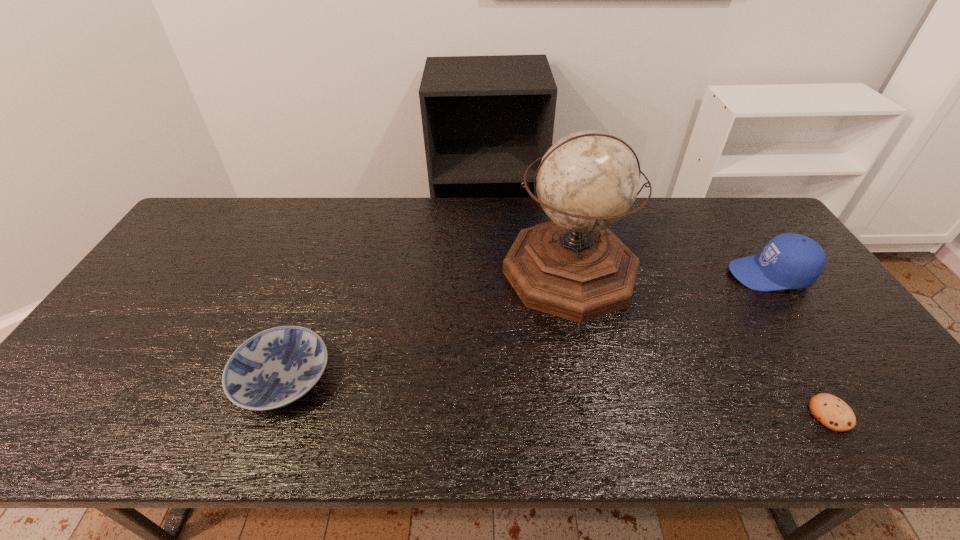
You are a GUI agent. You are given a task and a screenshot of the screen. Output one action in this format:
    pyautogui.click(x=<x>, y=<y>)
    Task: Click on the globe
    The width and height of the screenshot is (960, 540).
    Given the screenshot: What is the action you would take?
    (x=573, y=267)

Where is `the third object from right to left`? The image size is (960, 540). the third object from right to left is located at coordinates (573, 267).

Locate an element on the screen. the third shortest object is located at coordinates (788, 261).

Locate an element on the screen. plate is located at coordinates click(274, 368).

Where is `the leftmost object`? The width and height of the screenshot is (960, 540). the leftmost object is located at coordinates (274, 368).

Identify the location of the shortest object. The height and width of the screenshot is (540, 960). (832, 412).

Where is `free space located 0.280m on the surface of the second object from left to right`? The width and height of the screenshot is (960, 540). free space located 0.280m on the surface of the second object from left to right is located at coordinates (601, 420).

The height and width of the screenshot is (540, 960). In order to click on vacant position located on the front-facing side of the cap in this screenshot , I will do `click(646, 274)`.

This screenshot has height=540, width=960. What are the coordinates of `free space located on the front-facing side of the cap` in the screenshot? It's located at (686, 274).

At what (x,y) coordinates should I click in order to perform the action: click on free spot located 0.260m on the front-facing side of the cap. Please return your answer as a coordinate pair (x, y). Looking at the image, I should click on 642,274.